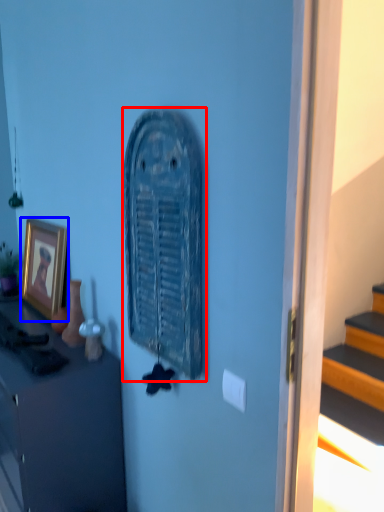
Question: Which point is closer to the camera, art (highlighted by a red box) or picture frame (highlighted by a blue box)?

Choices:
 (A) art
 (B) picture frame

Answer: (A)